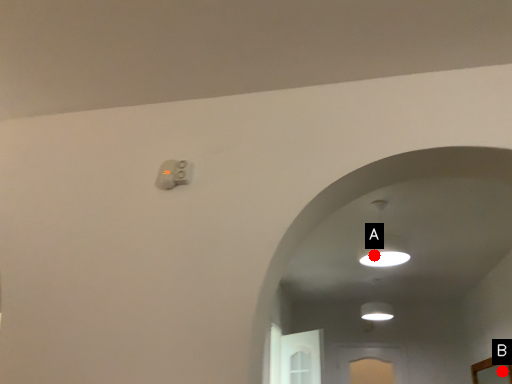
Question: Two points are circled on the image, labeled by A and B beside each circle. Which point is further to the camera?

Choices:
 (A) A is further
 (B) B is further

Answer: (B)